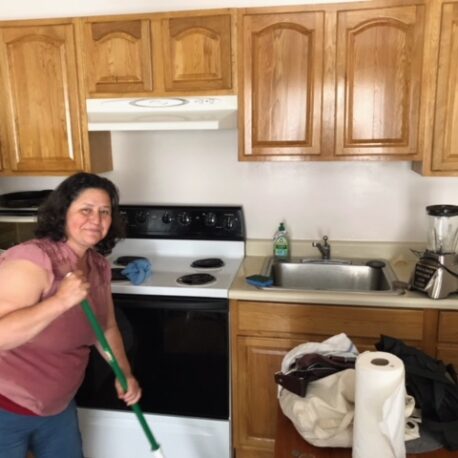
Identify the location of countertop backsplash. (363, 247).